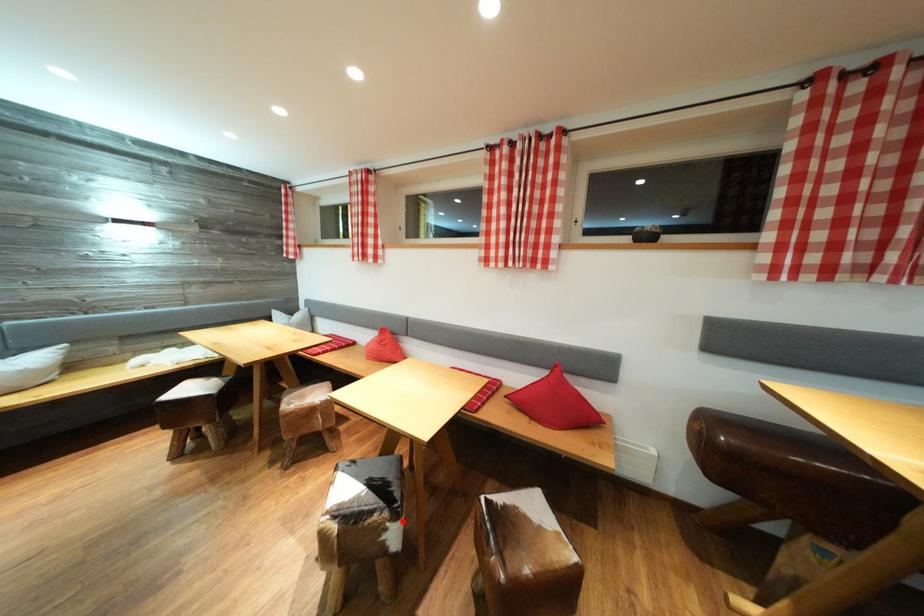
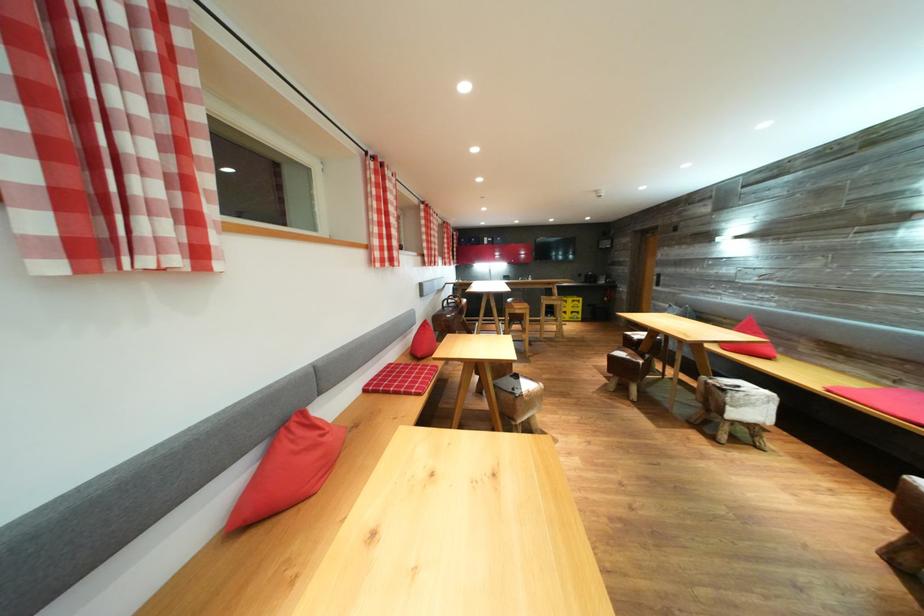
Question: I am providing you with two images of the same scene from different viewpoints. A red point is marked on the first image. Can you still see the location of the red point in image 2?

Choices:
 (A) Yes
 (B) No

Answer: (B)